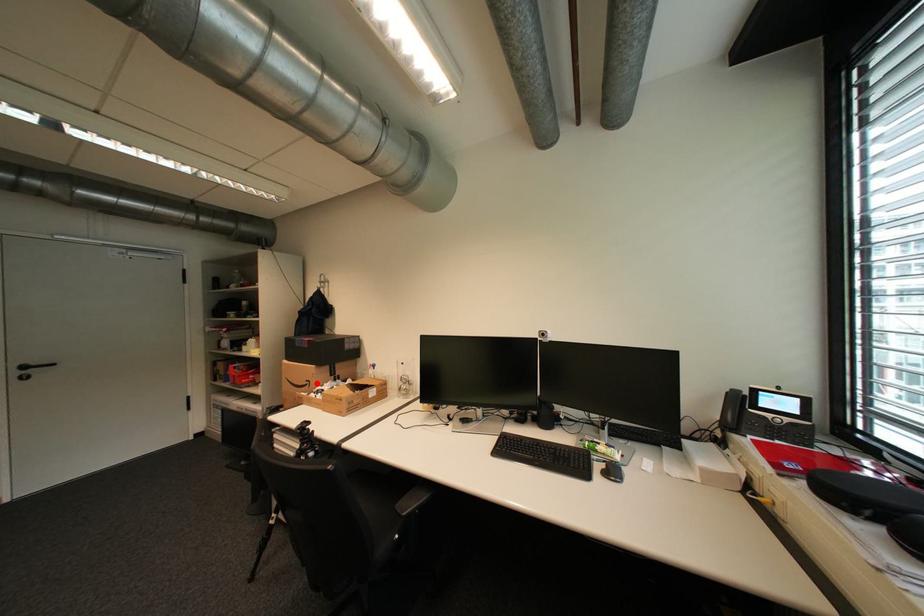
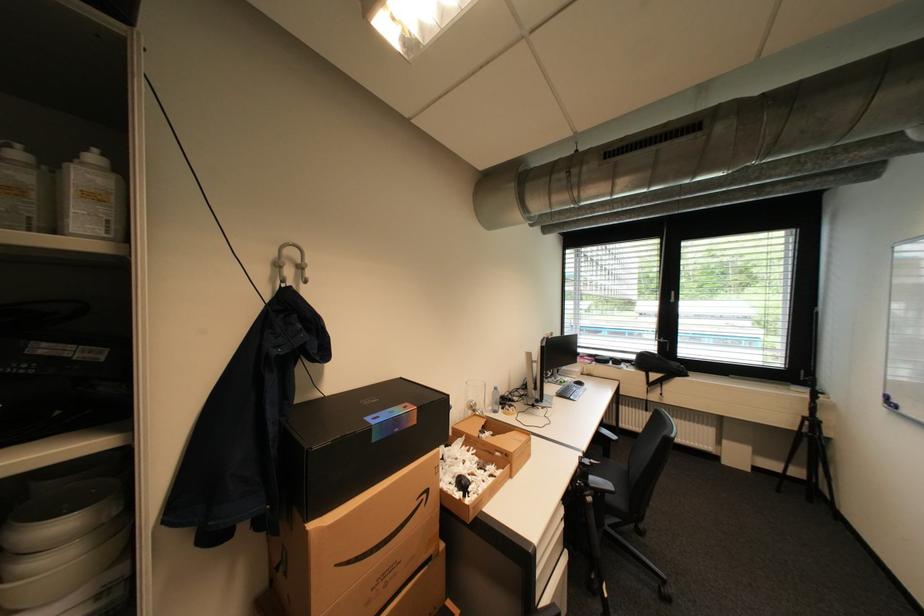
The point at the highlighted location is marked in the first image. Where is the corresponding point in the second image?

(433, 496)